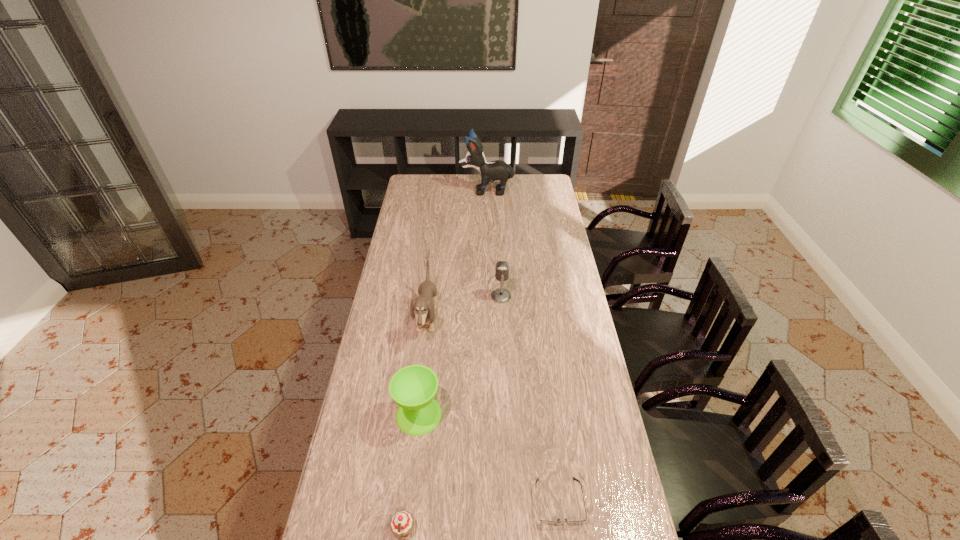
Locate an element on the screen. free spot that satisfies the following two spatial constraints: 1. on the back side of the microphone; 2. on the left side of the third nearest object is located at coordinates (432, 296).